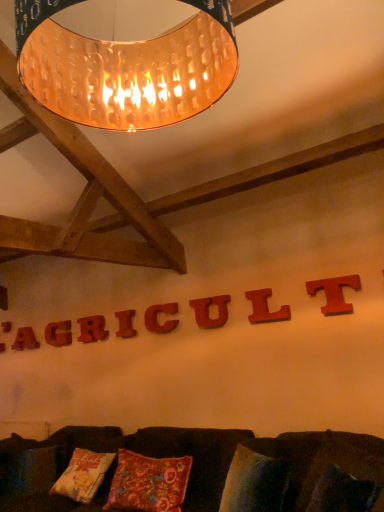
Question: Should I look upward or downward to see floral-patterned fabric pillow at center?

Choices:
 (A) up
 (B) down

Answer: (B)

Question: Is matte wooden letter at upper center, marked as the 2th letter in a left-to-right arrangement, positioned with its back to floral-patterned fabric pillow at center?

Choices:
 (A) no
 (B) yes

Answer: (A)

Question: Is the position of matte wooden letter at upper center, marked as the 2th letter in a left-to-right arrangement, less distant than that of floral-patterned fabric pillow at center?

Choices:
 (A) yes
 (B) no

Answer: (B)

Question: From the image's perspective, is matte wooden letter at upper center, which is the seventh letter in front-to-back order, over floral-patterned fabric pillow at center?

Choices:
 (A) yes
 (B) no

Answer: (A)

Question: Is matte wooden letter at upper center, marked as the 2th letter in a left-to-right arrangement, not within floral-patterned fabric pillow at center?

Choices:
 (A) yes
 (B) no

Answer: (A)

Question: Could you tell me if matte wooden letter at upper center, which appears as the seventh letter when viewed from the right, is facing floral-patterned fabric pillow at center?

Choices:
 (A) no
 (B) yes

Answer: (A)

Question: Is matte wooden letter at upper center, which is the seventh letter in front-to-back order, bigger than floral-patterned fabric pillow at center?

Choices:
 (A) no
 (B) yes

Answer: (A)

Question: Is matte red wooden t at upper center, the 8th letter viewed from the left, facing towards red wood letter u at center, the third letter when ordered from front to back?

Choices:
 (A) no
 (B) yes

Answer: (A)

Question: Is matte red wooden t at upper center, the 8th letter viewed from the left, oriented away from red wood letter u at center, the third letter when ordered from front to back?

Choices:
 (A) yes
 (B) no

Answer: (B)

Question: Is matte red wooden t at upper center, the first letter in the right-to-left sequence, not inside red wood letter u at center, the sixth letter when ordered from left to right?

Choices:
 (A) no
 (B) yes

Answer: (B)

Question: From a real-world perspective, is matte red wooden t at upper center, which appears as the 1th letter when viewed from the front, on red wood letter u at center, the sixth letter when ordered from left to right?

Choices:
 (A) yes
 (B) no

Answer: (A)

Question: Does matte red wooden t at upper center, the 8th letter viewed from the left, have a smaller size compared to red wood letter u at center, marked as the third letter in a right-to-left arrangement?

Choices:
 (A) no
 (B) yes

Answer: (A)

Question: Is matte red wooden t at upper center, the eighth letter in the back-to-front sequence, directly adjacent to red wood letter u at center, acting as the 6th letter starting from the back?

Choices:
 (A) no
 (B) yes

Answer: (A)

Question: Is matte red wooden t at upper center, which appears as the 1th letter when viewed from the front, placed right next to velvet cushion at lower center?

Choices:
 (A) yes
 (B) no

Answer: (B)